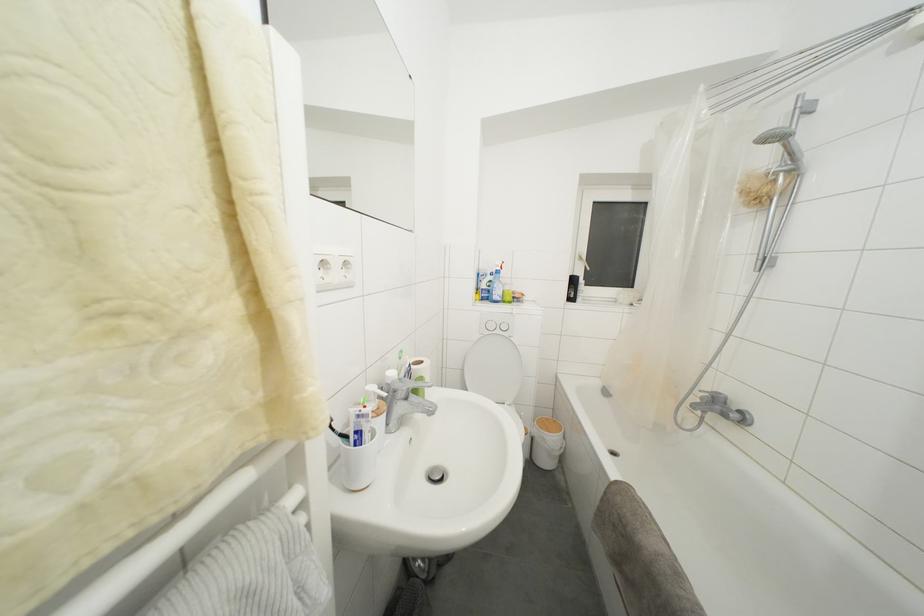
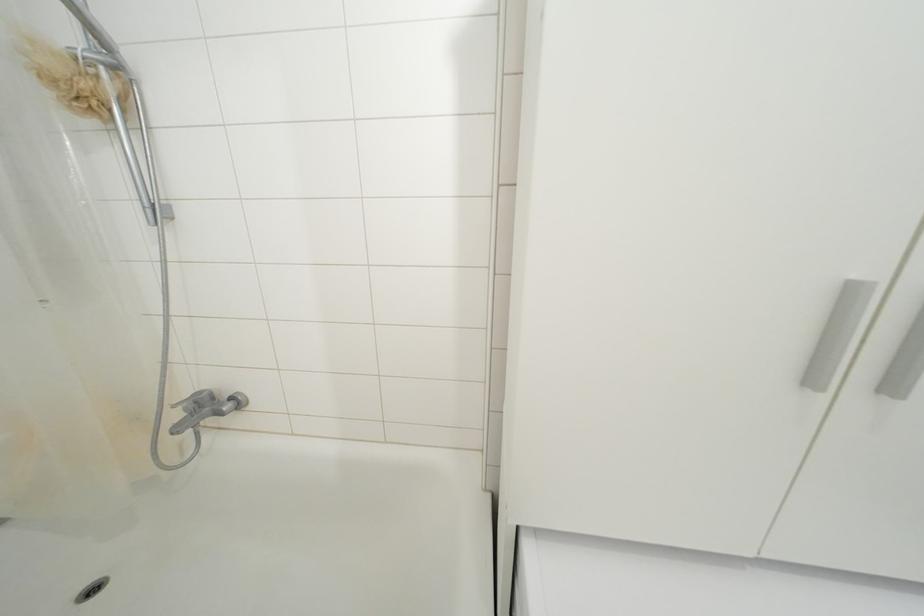
The point at (779,185) is marked in the first image. Where is the corresponding point in the second image?

(100, 79)